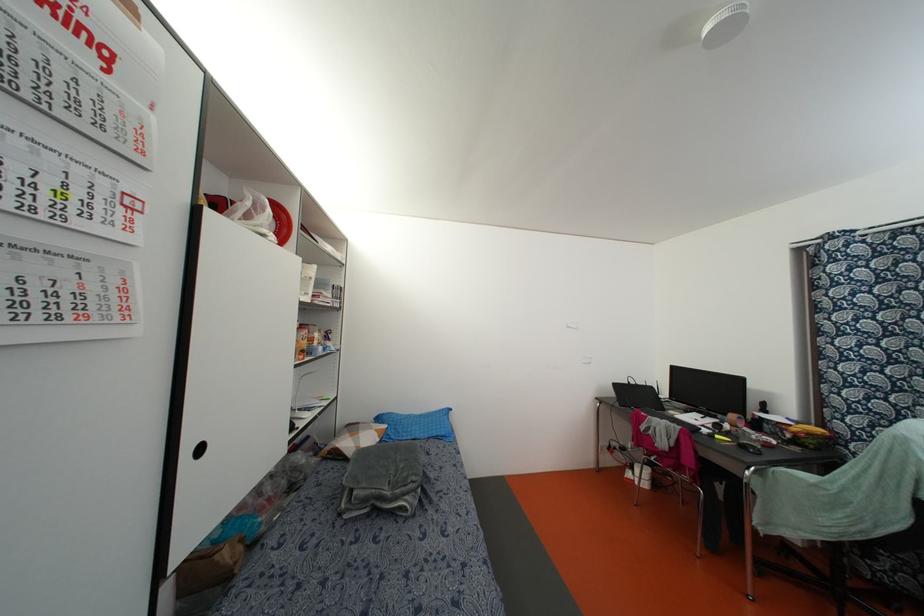
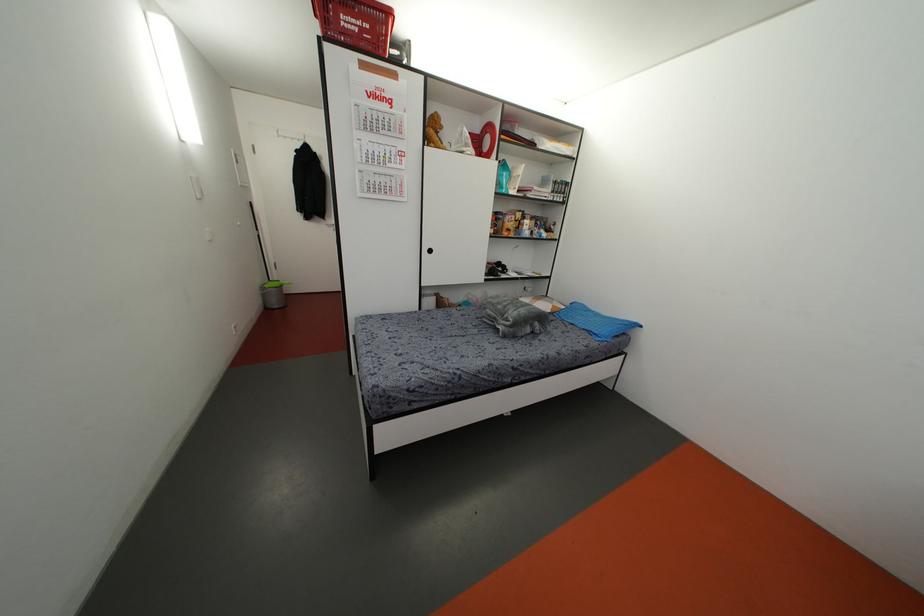
Where in the second image is the point corresponding to (301,351) from the first image?

(507, 229)